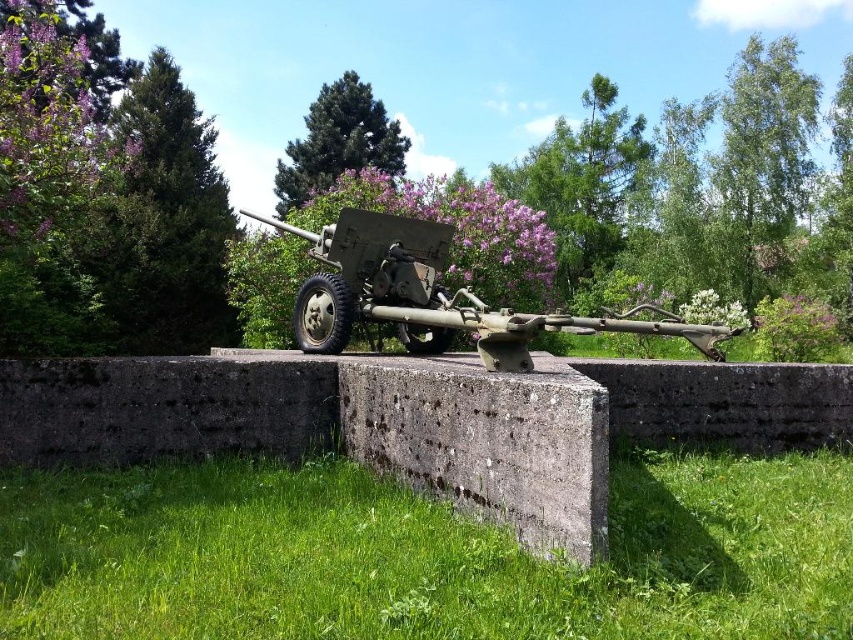
Which is in front, point (486, 516) or point (724, 106)?

Positioned in front is point (486, 516).

What do you see at coordinates (486, 442) in the screenshot?
I see `gray concrete at center` at bounding box center [486, 442].

Which is in front, point (372, 385) or point (784, 163)?

Positioned in front is point (372, 385).

In order to click on gray concrete at center in this screenshot , I will do `click(486, 442)`.

Between point (509, 328) and point (770, 227), which one is positioned in front?

Point (509, 328)

Who is lower down, matte green cannon at center or green leafy tree at upper right?

matte green cannon at center

Where is `matte green cannon at center`? Image resolution: width=853 pixels, height=640 pixels. matte green cannon at center is located at coordinates (434, 296).

Find the location of a particular element. matte green cannon at center is located at coordinates (434, 296).

Which is below, green grass at lower center or green leafy tree at upper center?

green grass at lower center is lower down.

Which is more to the left, green grass at lower center or green leafy tree at upper center?

From the viewer's perspective, green leafy tree at upper center appears more on the left side.

I want to click on green grass at lower center, so click(422, 554).